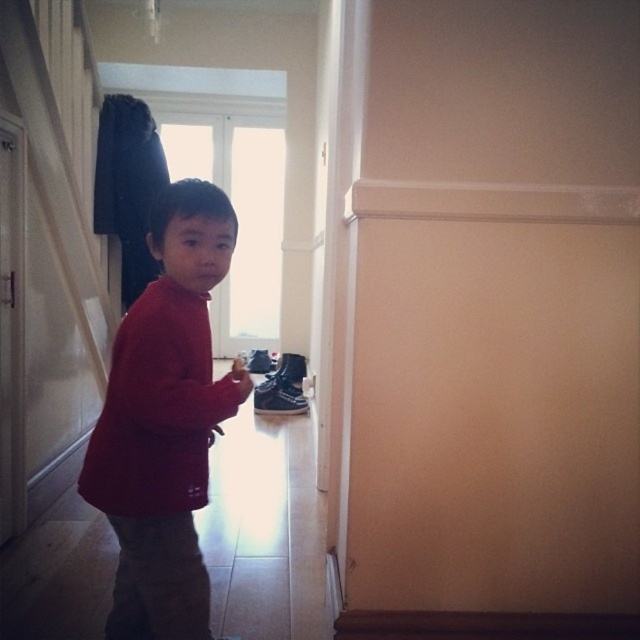
Is red matte sweater at center positioned before black suede shoe at lower center?

Yes, it is.

Identify the location of red matte sweater at center. (x=164, y=420).

Is point (120, 384) closer to camera compared to point (285, 365)?

Yes, point (120, 384) is in front of point (285, 365).

The image size is (640, 640). I want to click on red matte sweater at center, so click(164, 420).